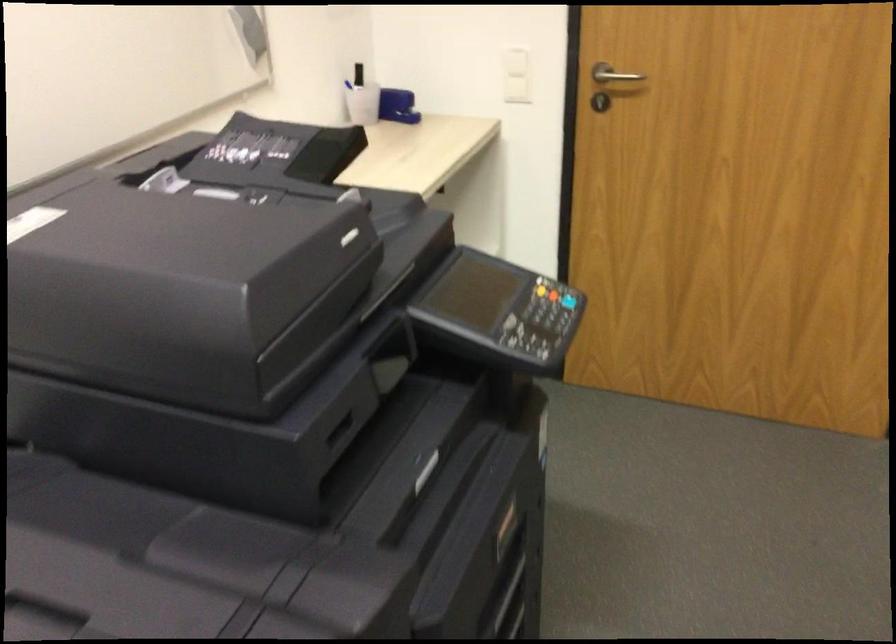
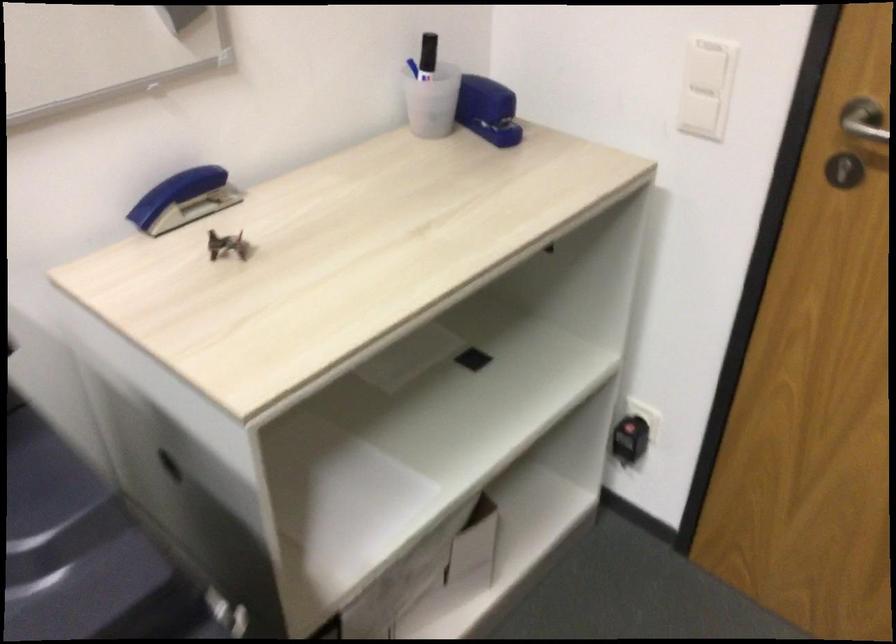
Question: How did the camera likely rotate?

Choices:
 (A) Left
 (B) Right
 (C) Up
 (D) Down

Answer: (A)